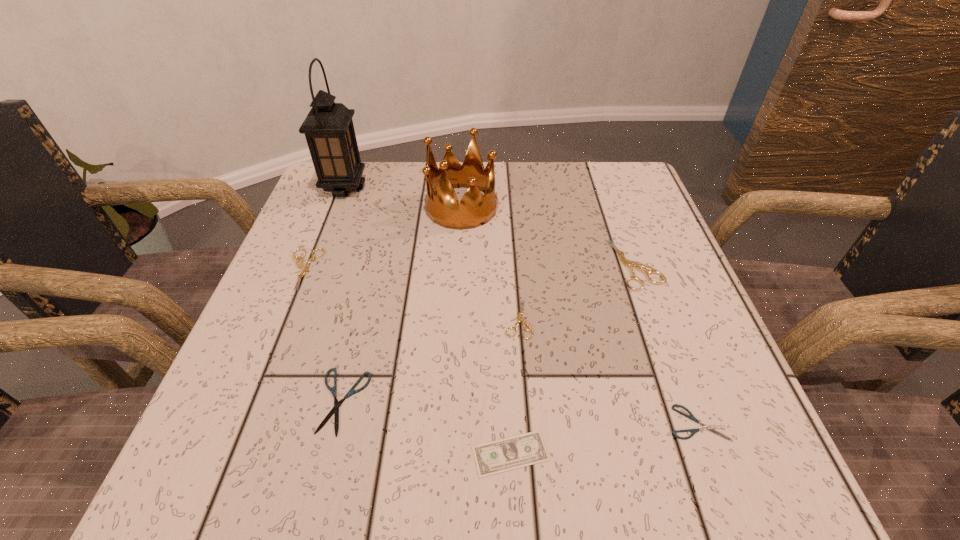
The height and width of the screenshot is (540, 960). Find the location of `vacant space at the far edge of the desktop`. vacant space at the far edge of the desktop is located at coordinates (502, 217).

Identify the location of vacant area at the left edge of the desktop. This screenshot has width=960, height=540. (351, 247).

In the image, there is a desktop. Identify the location of vacant space at the right edge. (691, 377).

Find the location of a particular element. The height and width of the screenshot is (540, 960). free space at the far right corner is located at coordinates (576, 162).

Where is `vacant area at the near right corner`? This screenshot has width=960, height=540. vacant area at the near right corner is located at coordinates (687, 461).

Where is `free spot between the sixth shortest object and the shortest object`? The image size is (960, 540). free spot between the sixth shortest object and the shortest object is located at coordinates (573, 359).

Locate an element on the screen. The image size is (960, 540). vacant space that is in between the tallest object and the rightmost beige shears is located at coordinates (490, 226).

This screenshot has height=540, width=960. I want to click on unoccupied position between the bigger black shears and the money, so click(x=426, y=428).

Where is `free space between the seventh tallest object and the money`? The height and width of the screenshot is (540, 960). free space between the seventh tallest object and the money is located at coordinates (605, 438).

This screenshot has height=540, width=960. Identify the location of vacant point located between the fourth shortest shears and the black lantern. (324, 229).